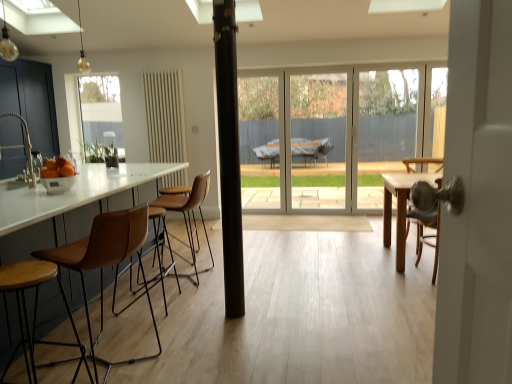
Identify the location of free space to the back side of brown leather stool at left. This screenshot has width=512, height=384. (144, 315).